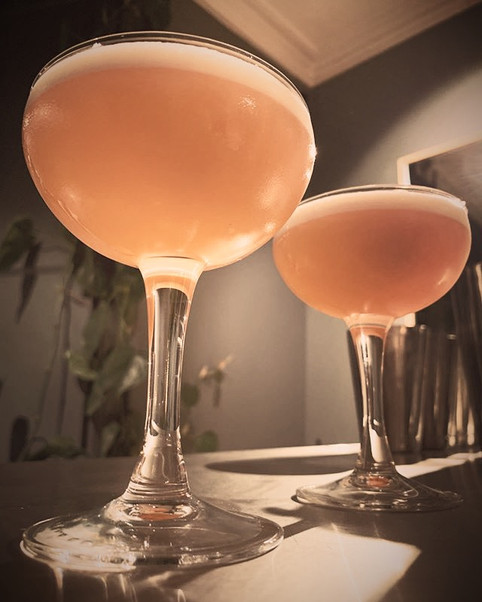
This screenshot has width=482, height=602. I want to click on foam, so click(x=181, y=59).